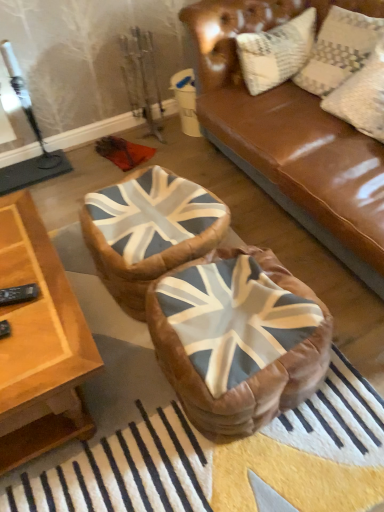
Question: In which direction should I rotate to look at leather union jack bean bag at center, the 1th bean bag chair viewed from the back?

Choices:
 (A) right
 (B) left

Answer: (B)

Question: Can you confirm if leather bean bag at center, positioned as the 2th bean bag chair in back-to-front order, is wider than textured cream pillow at upper right?

Choices:
 (A) yes
 (B) no

Answer: (A)

Question: Is leather bean bag at center, acting as the first bean bag chair starting from the front, positioned with its back to textured cream pillow at upper right?

Choices:
 (A) yes
 (B) no

Answer: (B)

Question: Can you confirm if leather bean bag at center, acting as the first bean bag chair starting from the front, is taller than textured cream pillow at upper right?

Choices:
 (A) no
 (B) yes

Answer: (A)

Question: Is textured cream pillow at upper right located within leather bean bag at center, acting as the first bean bag chair starting from the front?

Choices:
 (A) yes
 (B) no

Answer: (B)

Question: Is leather bean bag at center, acting as the first bean bag chair starting from the front, at the left side of textured cream pillow at upper right?

Choices:
 (A) no
 (B) yes

Answer: (B)

Question: From the image's perspective, is leather bean bag at center, acting as the first bean bag chair starting from the front, above textured cream pillow at upper right?

Choices:
 (A) yes
 (B) no

Answer: (B)

Question: Is wooden table at lower left completely or partially outside of textured cream pillow at upper right?

Choices:
 (A) yes
 (B) no

Answer: (A)

Question: Would you consider wooden table at lower left to be distant from textured cream pillow at upper right?

Choices:
 (A) no
 (B) yes

Answer: (B)

Question: Considering the relative positions of wooden table at lower left and textured cream pillow at upper right in the image provided, is wooden table at lower left behind textured cream pillow at upper right?

Choices:
 (A) yes
 (B) no

Answer: (B)

Question: Does wooden table at lower left have a greater height compared to textured cream pillow at upper right?

Choices:
 (A) no
 (B) yes

Answer: (A)

Question: From a real-world perspective, does wooden table at lower left sit lower than textured cream pillow at upper right?

Choices:
 (A) no
 (B) yes

Answer: (B)

Question: Is wooden table at lower left at the right side of textured cream pillow at upper right?

Choices:
 (A) no
 (B) yes

Answer: (A)

Question: From a real-world perspective, is textured cream pillow at upper right positioned under wooden table at lower left based on gravity?

Choices:
 (A) no
 (B) yes

Answer: (A)